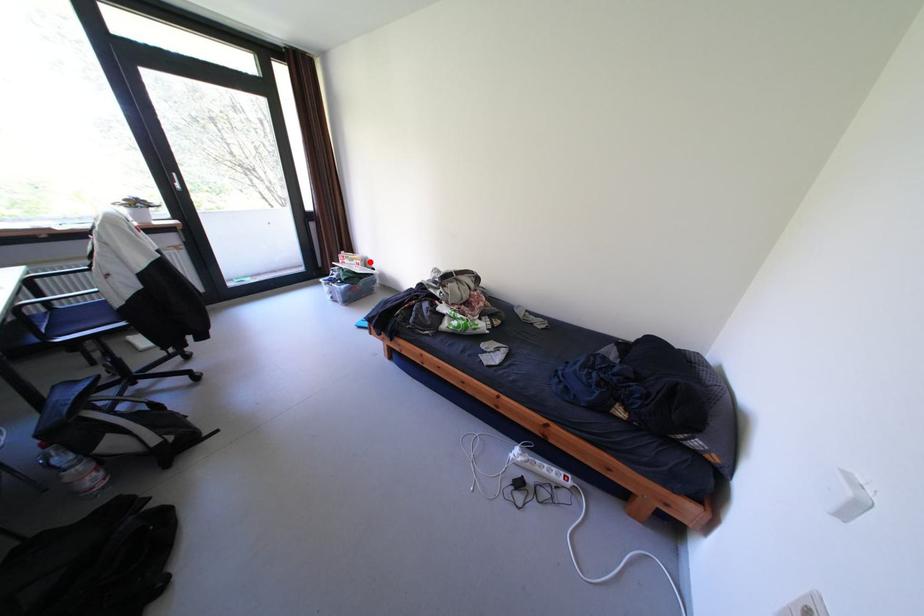
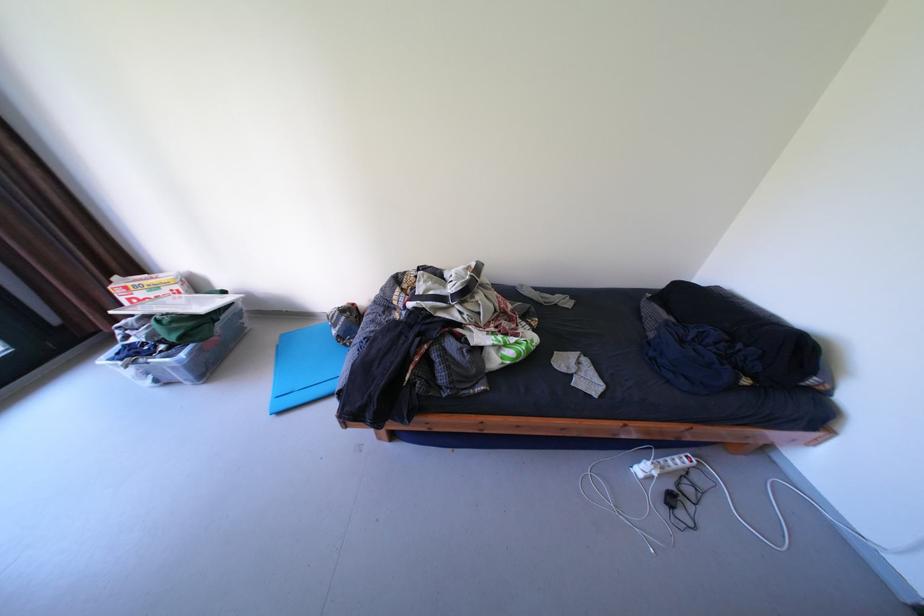
In the second image, find the point that corresponds to the highlighted location in the first image.

(188, 286)